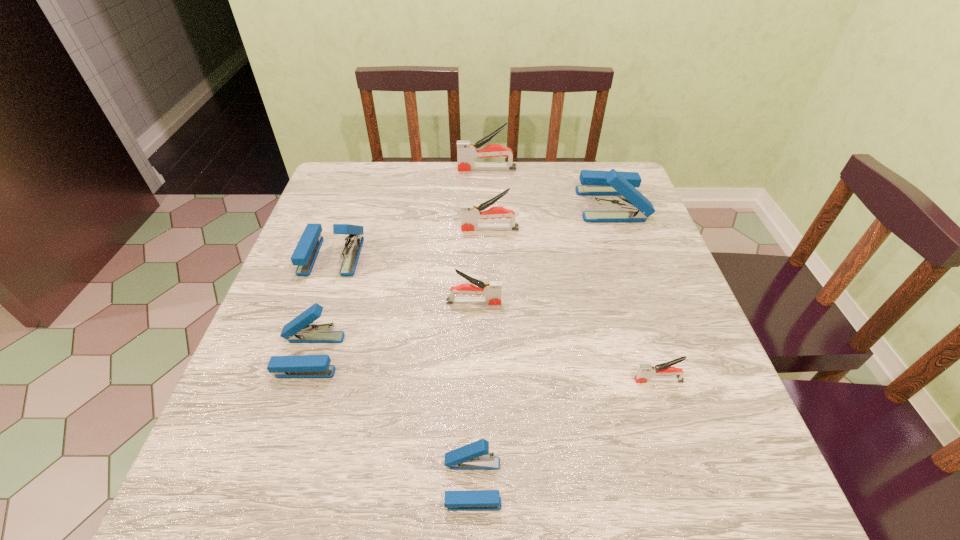
Identify the location of object at the far right corner. This screenshot has height=540, width=960. (594, 183).

This screenshot has width=960, height=540. Identify the location of free region at the far edge of the desktop. (514, 203).

Locate an element on the screen. This screenshot has height=540, width=960. blank space at the near edge of the desktop is located at coordinates (616, 509).

The image size is (960, 540). In order to click on free space at the left edge of the desktop in this screenshot , I will do `click(300, 392)`.

At what (x,y) coordinates should I click in order to perform the action: click on free space at the far left corner of the desktop. Please return your answer as a coordinate pair (x, y). The image size is (960, 540). Looking at the image, I should click on (324, 202).

The image size is (960, 540). I want to click on free space at the near left corner of the desktop, so click(x=197, y=485).

This screenshot has width=960, height=540. Find the location of `free space at the far right corner`. free space at the far right corner is located at coordinates tap(615, 165).

Locate an element on the screen. The width and height of the screenshot is (960, 540). vacant space at the near right corner is located at coordinates [x=662, y=475].

Find the location of a particular element. vacant space in between the third nearest blue stapler and the smallest gray stapler is located at coordinates (495, 318).

The image size is (960, 540). Find the location of `free space between the fourth nearest object and the biggest blue stapler`. free space between the fourth nearest object and the biggest blue stapler is located at coordinates (542, 253).